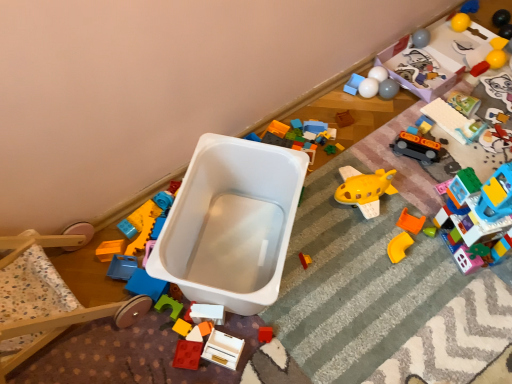
I want to click on free location to the left of white plastic toy at center, the 14th toy when ordered from right to left, so click(146, 335).